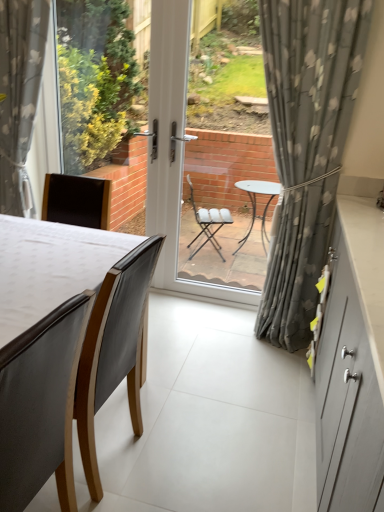
Identify the location of vacant space in front of gray floral curtain at center, placed as the second curtain when sorted from left to right. This screenshot has height=512, width=384. (x=257, y=370).